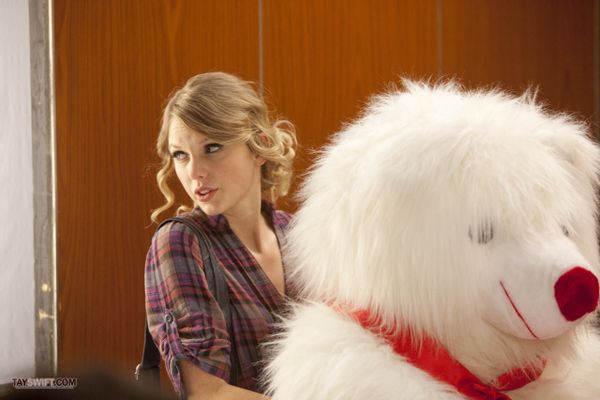
In order to click on wall panels in this screenshot , I will do pos(176,63), pos(360,58), pos(527,60).